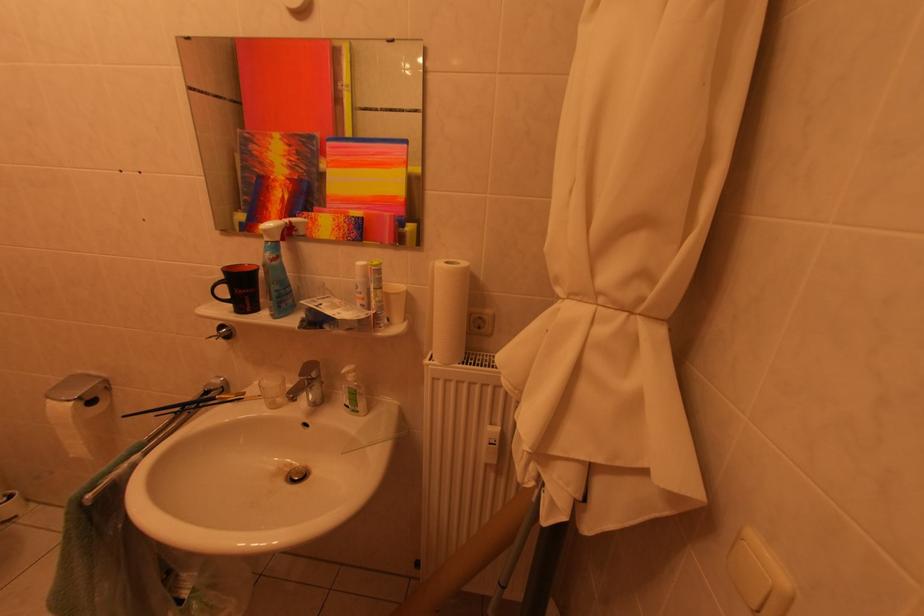
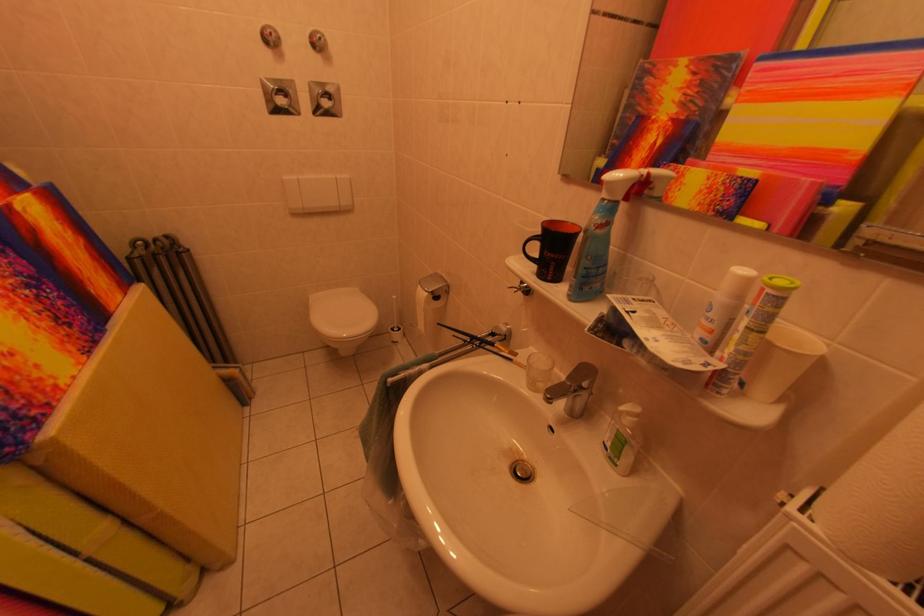
The point at (x=382, y=315) is marked in the first image. Where is the corresponding point in the second image?

(732, 370)